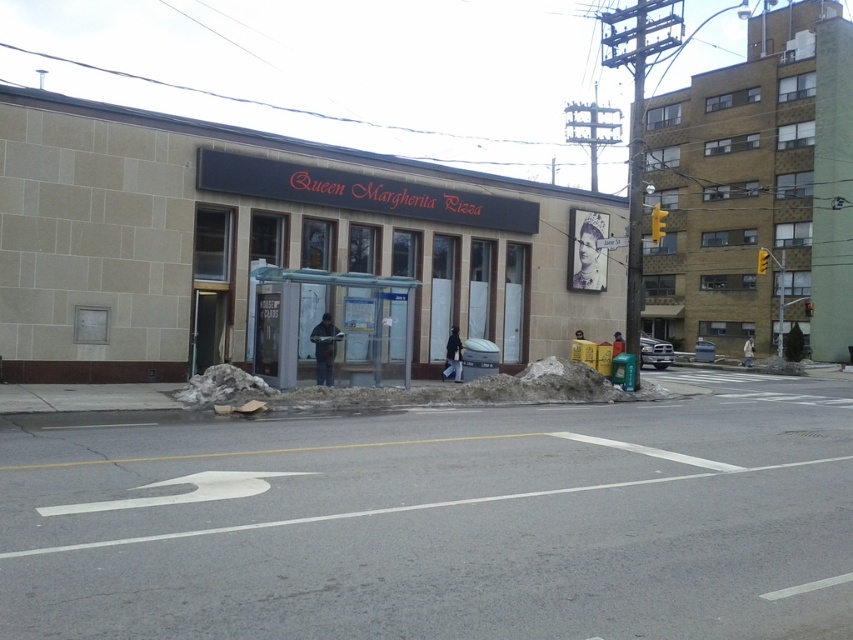
Question: Which point is farther to the camera?

Choices:
 (A) white snow at center
 (B) black matte sign at center
 (C) beige stone building at center

Answer: (B)

Question: In this image, where is beige stone building at center located relative to white snow at center?

Choices:
 (A) below
 (B) above

Answer: (B)

Question: Can you confirm if beige stone building at center is wider than white snow at center?

Choices:
 (A) yes
 (B) no

Answer: (A)

Question: Which is farther from the white snow at center?

Choices:
 (A) beige stone building at center
 (B) black matte sign at center

Answer: (B)

Question: Where is black matte sign at center located in relation to white snow at center in the image?

Choices:
 (A) left
 (B) right

Answer: (A)

Question: Which point appears farthest from the camera in this image?

Choices:
 (A) (219, 369)
 (B) (519, 273)

Answer: (B)